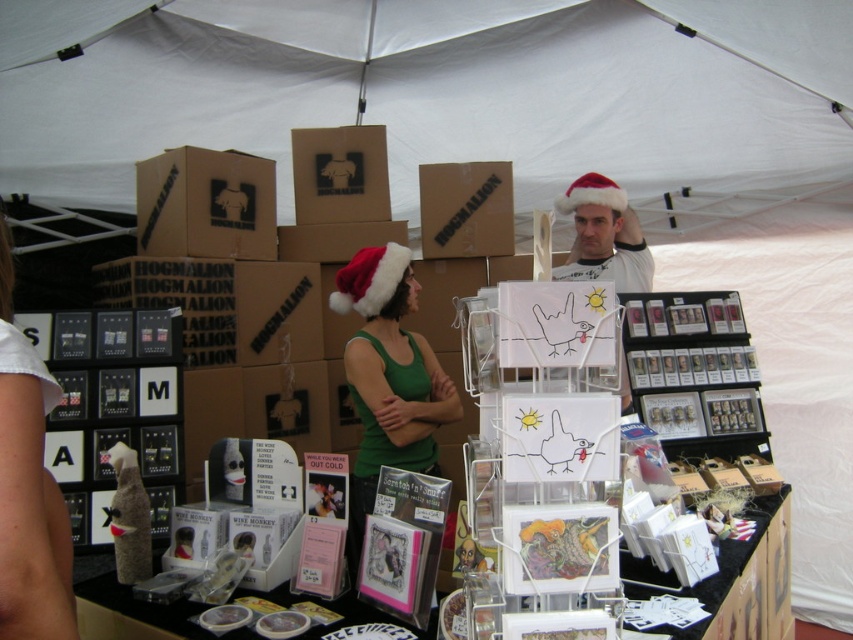
Question: Estimate the real-world distances between objects in this image. Which object is farther from the fuzzy red santa hat at center?

Choices:
 (A) clear plastic cards at center
 (B) white matte santa hat at center

Answer: (A)

Question: Can you confirm if green matte tank top at center is thinner than cardboard box at upper center?

Choices:
 (A) no
 (B) yes

Answer: (B)

Question: Which point is closer to the camera taking this photo?

Choices:
 (A) (769, 516)
 (B) (585, 176)
 (C) (581, 253)

Answer: (A)

Question: Can you confirm if green matte tank top at center is positioned to the right of cardboard box at upper center?

Choices:
 (A) yes
 (B) no

Answer: (A)

Question: Which point is closer to the camera taking this photo?

Choices:
 (A) (563, 65)
 (B) (187, 637)
 (C) (585, 237)

Answer: (B)

Question: Does brown cardboard box at center appear on the left side of red velvet santa hat at center?

Choices:
 (A) no
 (B) yes

Answer: (B)